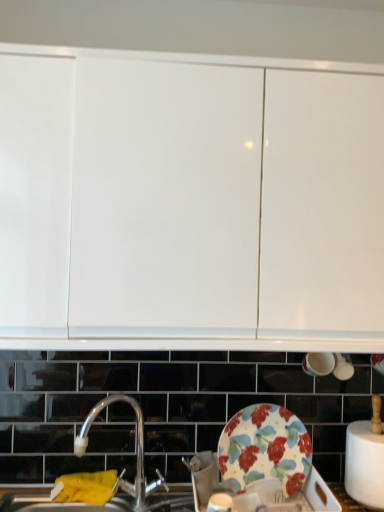
From the picture: What is the approximate width of yellow fabric at lower left?

The width of yellow fabric at lower left is 5.99 inches.

Find the location of `white glossy cabinet at upper center`. white glossy cabinet at upper center is located at coordinates (190, 202).

Locate an element on the screen. silver metallic tap at center is located at coordinates (137, 451).

From a real-world perspective, who is located lower, silver metallic tap at center or floral-patterned ceramic plate at lower center?

silver metallic tap at center.

Based on their positions, is silver metallic tap at center located to the left or right of floral-patterned ceramic plate at lower center?

Based on their positions, silver metallic tap at center is located to the left of floral-patterned ceramic plate at lower center.

What's the angular difference between silver metallic tap at center and floral-patterned ceramic plate at lower center's facing directions?

silver metallic tap at center and floral-patterned ceramic plate at lower center are facing 54.7 degrees away from each other.

Between silver metallic tap at center and floral-patterned ceramic plate at lower center, which one has larger size?

silver metallic tap at center.

Which is correct: floral-patterned ceramic plate at lower center is inside yellow fabric at lower left, or outside of it?

floral-patterned ceramic plate at lower center lies outside yellow fabric at lower left.

From a real-world perspective, which object rests below the other?

yellow fabric at lower left.

How far apart are floral-patterned ceramic plate at lower center and yellow fabric at lower left?

They are 19.25 inches apart.

Which is more to the right, floral-patterned ceramic plate at lower center or yellow fabric at lower left?

From the viewer's perspective, floral-patterned ceramic plate at lower center appears more on the right side.

From the image's perspective, would you say white glossy cabinet at upper center is shown under yellow fabric at lower left?

Actually, white glossy cabinet at upper center appears above yellow fabric at lower left in the image.

Considering their positions, is white glossy cabinet at upper center located in front of or behind yellow fabric at lower left?

white glossy cabinet at upper center is in front of yellow fabric at lower left.

Is white glossy cabinet at upper center aimed at yellow fabric at lower left?

No, white glossy cabinet at upper center is not aimed at yellow fabric at lower left.

How different are the orientations of white glossy cabinet at upper center and yellow fabric at lower left in degrees?

The facing directions of white glossy cabinet at upper center and yellow fabric at lower left are 1.38 degrees apart.

Based on the photo, is silver metallic tap at center spatially inside yellow fabric at lower left, or outside of it?

silver metallic tap at center is located beyond the bounds of yellow fabric at lower left.

Between silver metallic tap at center and yellow fabric at lower left, which one appears on the left side from the viewer's perspective?

From the viewer's perspective, yellow fabric at lower left appears more on the left side.

Considering the sizes of silver metallic tap at center and yellow fabric at lower left in the image, is silver metallic tap at center wider or thinner than yellow fabric at lower left?

silver metallic tap at center is wider than yellow fabric at lower left.

Which object is more forward, silver metallic tap at center or yellow fabric at lower left?

silver metallic tap at center is more forward.

Is point (67, 262) closer or farther from the camera than point (99, 406)?

Point (67, 262) is positioned closer to the camera compared to point (99, 406).

Does white glossy cabinet at upper center appear on the right side of silver metallic tap at center?

Indeed, white glossy cabinet at upper center is positioned on the right side of silver metallic tap at center.

From a real-world perspective, between white glossy cabinet at upper center and silver metallic tap at center, who is vertically lower?

silver metallic tap at center, from a real-world perspective.

Is yellow fabric at lower left thinner than silver metallic tap at center?

Indeed, yellow fabric at lower left has a lesser width compared to silver metallic tap at center.

Which object is positioned more to the left, yellow fabric at lower left or silver metallic tap at center?

yellow fabric at lower left.

From a real-world perspective, is yellow fabric at lower left physically above silver metallic tap at center?

No.

Considering the positions of objects silver metallic tap at center and white glossy cabinet at upper center in the image provided, who is in front, silver metallic tap at center or white glossy cabinet at upper center?

Positioned in front is white glossy cabinet at upper center.

Is silver metallic tap at center next to white glossy cabinet at upper center and touching it?

No, silver metallic tap at center is not with white glossy cabinet at upper center.

Can you confirm if silver metallic tap at center is shorter than white glossy cabinet at upper center?

Yes, silver metallic tap at center is shorter than white glossy cabinet at upper center.

From the image's perspective, is silver metallic tap at center on white glossy cabinet at upper center?

No.

Find the location of `tap beneath the floral-patterned ceramic plate at lower center (from a real-world perspective)`. tap beneath the floral-patterned ceramic plate at lower center (from a real-world perspective) is located at coordinates (137, 451).

Where is `material below the floral-patterned ceramic plate at lower center (from the image's perspective)`? material below the floral-patterned ceramic plate at lower center (from the image's perspective) is located at coordinates (85, 487).

From the image, which object appears to be nearer to silver metallic tap at center, white glossy cabinet at upper center or floral-patterned ceramic plate at lower center?

Based on the image, floral-patterned ceramic plate at lower center appears to be nearer to silver metallic tap at center.

Which object lies nearer to the anchor point yellow fabric at lower left, floral-patterned ceramic plate at lower center or white glossy cabinet at upper center?

floral-patterned ceramic plate at lower center lies closer to yellow fabric at lower left than the other object.

Looking at the image, which one is located closer to yellow fabric at lower left, white glossy cabinet at upper center or floral-patterned ceramic plate at lower center?

floral-patterned ceramic plate at lower center is positioned closer to the anchor yellow fabric at lower left.

When comparing their distances from yellow fabric at lower left, does silver metallic tap at center or white glossy cabinet at upper center seem further?

white glossy cabinet at upper center is further to yellow fabric at lower left.

Which object lies further to the anchor point white glossy cabinet at upper center, silver metallic tap at center or yellow fabric at lower left?

yellow fabric at lower left lies further to white glossy cabinet at upper center than the other object.

When comparing their distances from floral-patterned ceramic plate at lower center, does white glossy cabinet at upper center or silver metallic tap at center seem closer?

The object closer to floral-patterned ceramic plate at lower center is silver metallic tap at center.

Estimate the real-world distances between objects in this image. Which object is further from white glossy cabinet at upper center, floral-patterned ceramic plate at lower center or silver metallic tap at center?

Based on the image, silver metallic tap at center appears to be further to white glossy cabinet at upper center.

Estimate the real-world distances between objects in this image. Which object is closer to yellow fabric at lower left, silver metallic tap at center or floral-patterned ceramic plate at lower center?

The object closer to yellow fabric at lower left is silver metallic tap at center.

Locate an element on the screen. The width and height of the screenshot is (384, 512). plate that lies between white glossy cabinet at upper center and yellow fabric at lower left from top to bottom is located at coordinates (265, 448).

Locate an element on the screen. The width and height of the screenshot is (384, 512). tap between yellow fabric at lower left and floral-patterned ceramic plate at lower center from left to right is located at coordinates (137, 451).

This screenshot has height=512, width=384. Identify the location of plate between white glossy cabinet at upper center and silver metallic tap at center from top to bottom. (265, 448).

The image size is (384, 512). Identify the location of tap that lies between white glossy cabinet at upper center and yellow fabric at lower left from top to bottom. (137, 451).